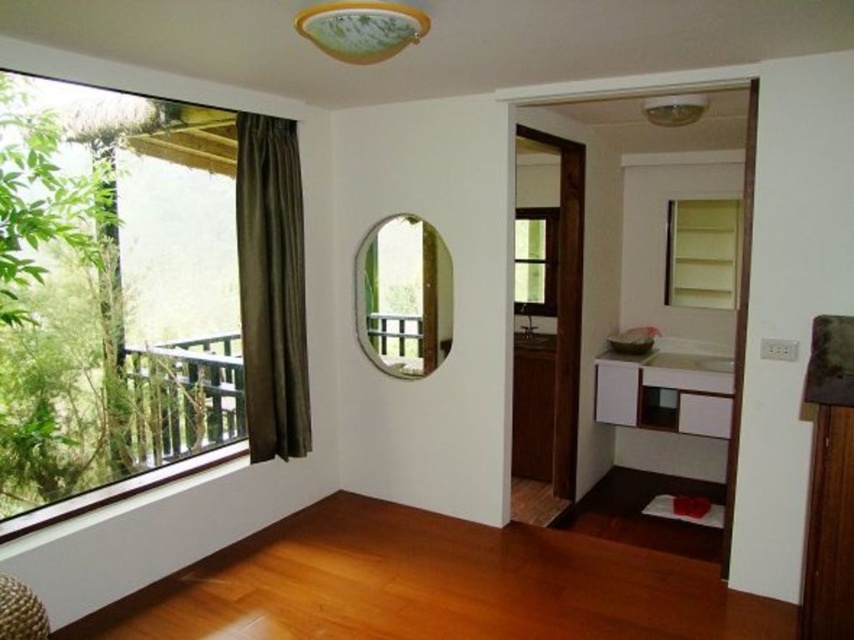
Question: Is clear glass mirror at center to the right of green glass window at center from the viewer's perspective?

Choices:
 (A) yes
 (B) no

Answer: (B)

Question: In this image, where is green glass window at center located relative to woven straw stool at lower left?

Choices:
 (A) below
 (B) above

Answer: (B)

Question: Which point appears farthest from the camera in this image?

Choices:
 (A) (4, 596)
 (B) (525, 308)

Answer: (B)

Question: Observing the image, what is the correct spatial positioning of clear glass mirror at center in reference to woven straw stool at lower left?

Choices:
 (A) above
 (B) below

Answer: (A)

Question: Which point is closer to the camera taking this photo?

Choices:
 (A) (550, 314)
 (B) (301, 323)
 (C) (408, 301)
 (D) (68, 378)

Answer: (D)

Question: Which point appears closest to the camera in this image?

Choices:
 (A) (519, 259)
 (B) (108, 234)
 (C) (259, 428)
 (D) (34, 624)

Answer: (D)